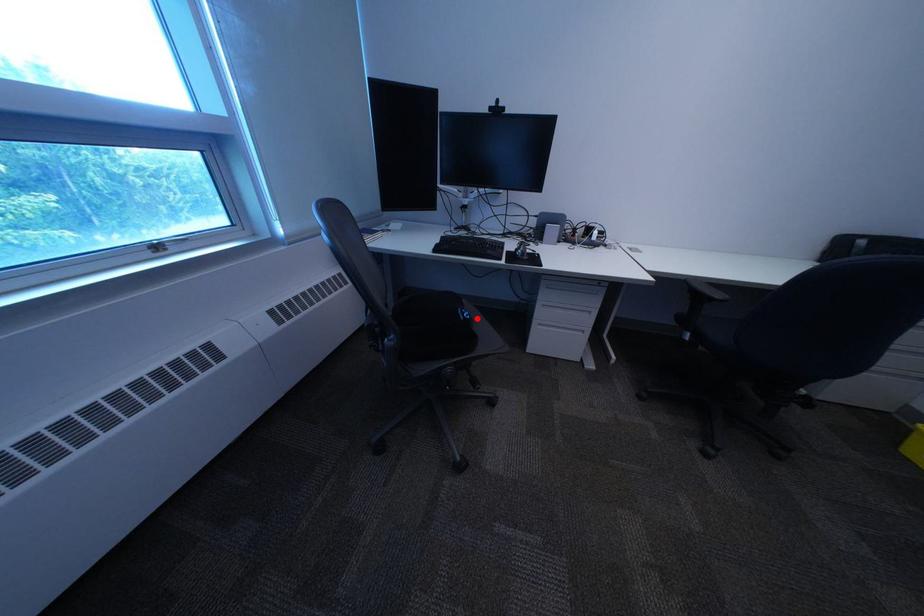
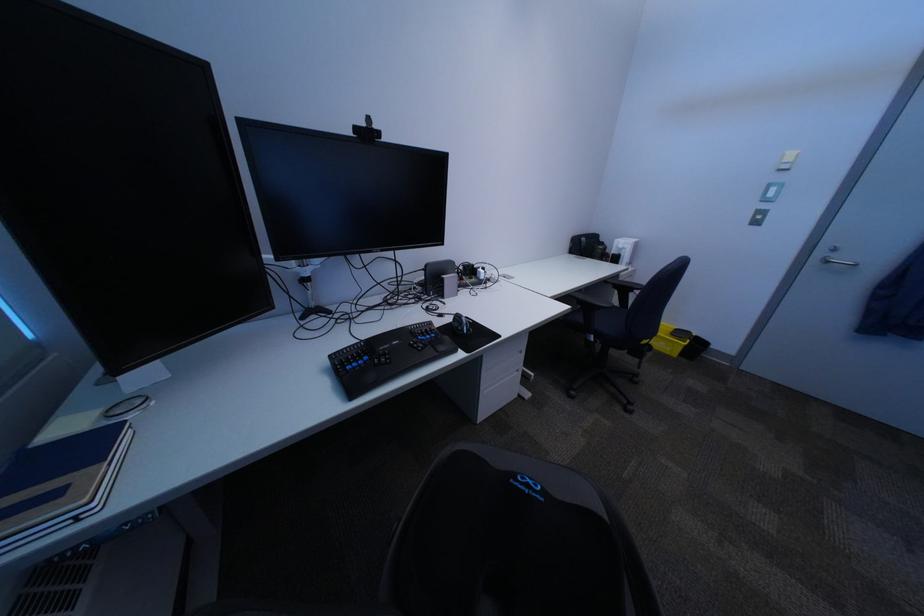
Locate, in the second image, the point that corresponds to the highlighted location in the first image.

(554, 499)